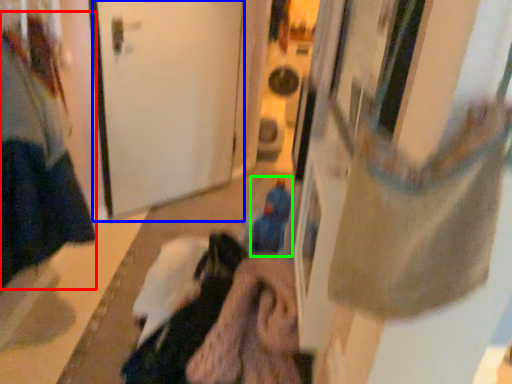
Question: Based on their relative distances, which object is farther from woman (highlighted by a red box)? Choose from door (highlighted by a blue box) and toy (highlighted by a green box).

Choices:
 (A) door
 (B) toy

Answer: (B)